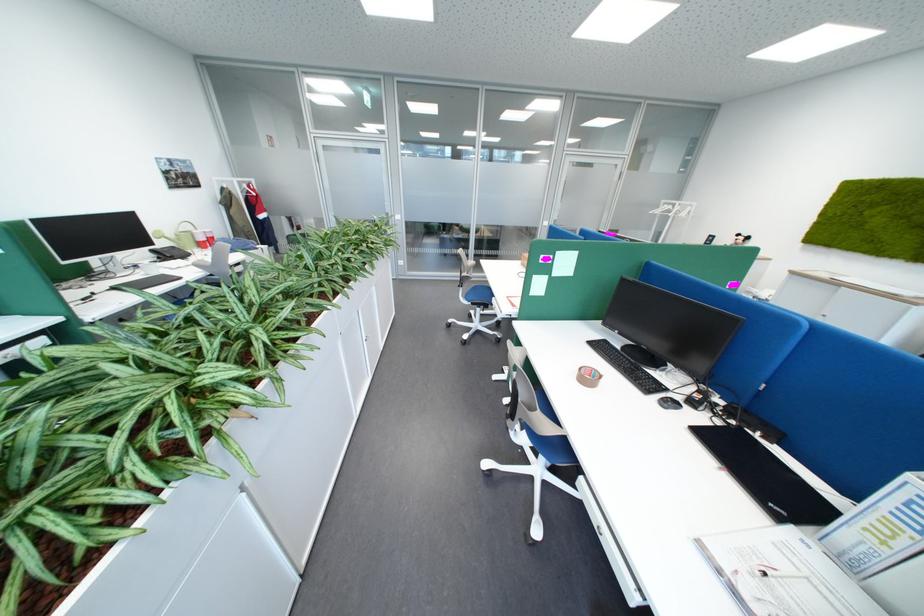
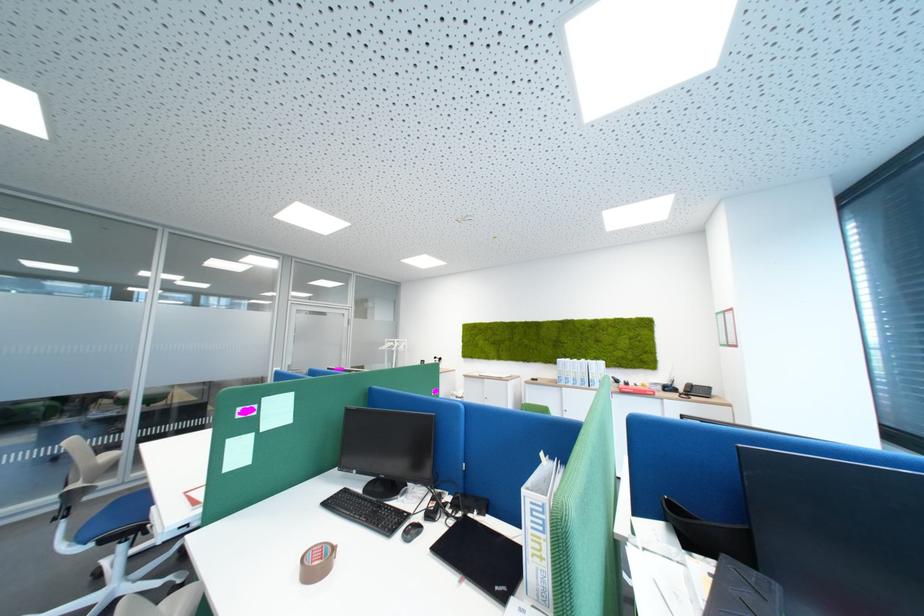
In the second image, find the point that corresponds to the point at 879,531 in the first image.

(545, 556)